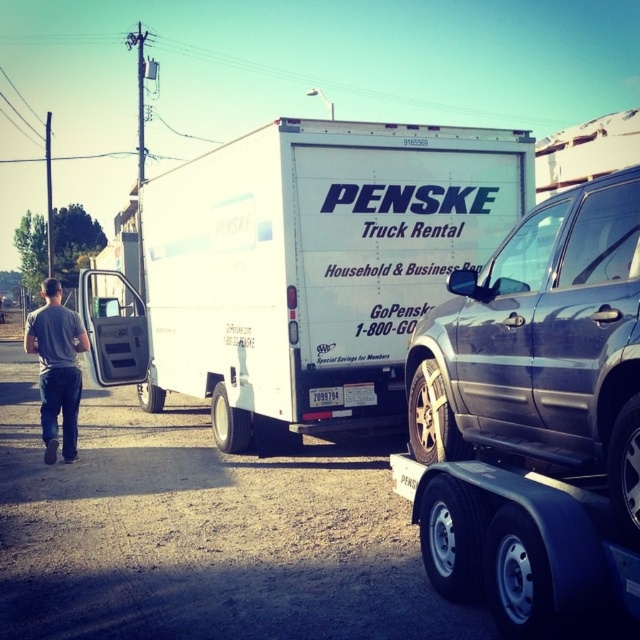
Is white matte truck at center below gray cotton shirt at center?

No, white matte truck at center is not below gray cotton shirt at center.

Is white matte truck at center taller than gray cotton shirt at center?

Yes, white matte truck at center is taller than gray cotton shirt at center.

Is point (108, 291) positioned behind point (64, 392)?

Yes, it is behind point (64, 392).

The height and width of the screenshot is (640, 640). What are the coordinates of `white matte truck at center` in the screenshot? It's located at (301, 272).

Is white matte truck at center closer to camera compared to metallic gray suv at right?

No, white matte truck at center is further to the viewer.

Is point (275, 268) behind point (609, 390)?

Yes.

Find the location of a particular element. This screenshot has height=640, width=640. white matte truck at center is located at coordinates (301, 272).

Is metallic gray suv at right smaller than gray cotton shirt at center?

Indeed, metallic gray suv at right has a smaller size compared to gray cotton shirt at center.

Is metallic gray suv at right above gray cotton shirt at center?

Correct, metallic gray suv at right is located above gray cotton shirt at center.

At what (x,y) coordinates should I click in order to perform the action: click on metallic gray suv at right. Please return your answer as a coordinate pair (x, y). The height and width of the screenshot is (640, 640). Looking at the image, I should click on (541, 346).